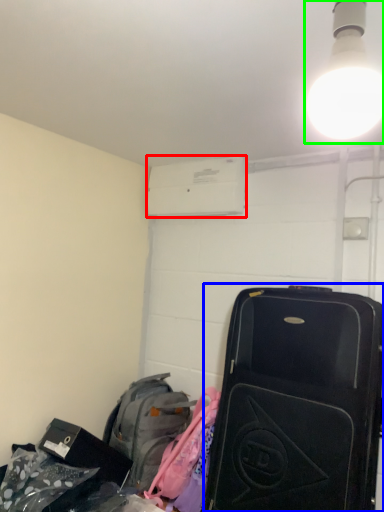
Question: Which object is positioned closest to air conditioning (highlighted by a red box)? Select from suitcase (highlighted by a blue box) and light fixture (highlighted by a green box).

Choices:
 (A) suitcase
 (B) light fixture

Answer: (A)